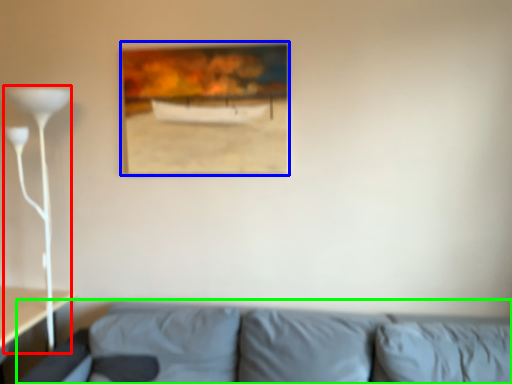
Question: Estimate the real-world distances between objects in this image. Which object is closer to table lamp (highlighted by a red box), picture frame (highlighted by a blue box) or studio couch (highlighted by a green box)?

Choices:
 (A) picture frame
 (B) studio couch

Answer: (A)